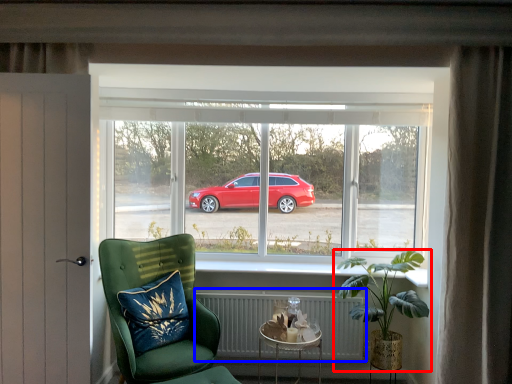
Question: Which point is further to the camera, houseplant (highlighted by a red box) or radiator (highlighted by a blue box)?

Choices:
 (A) houseplant
 (B) radiator

Answer: (B)